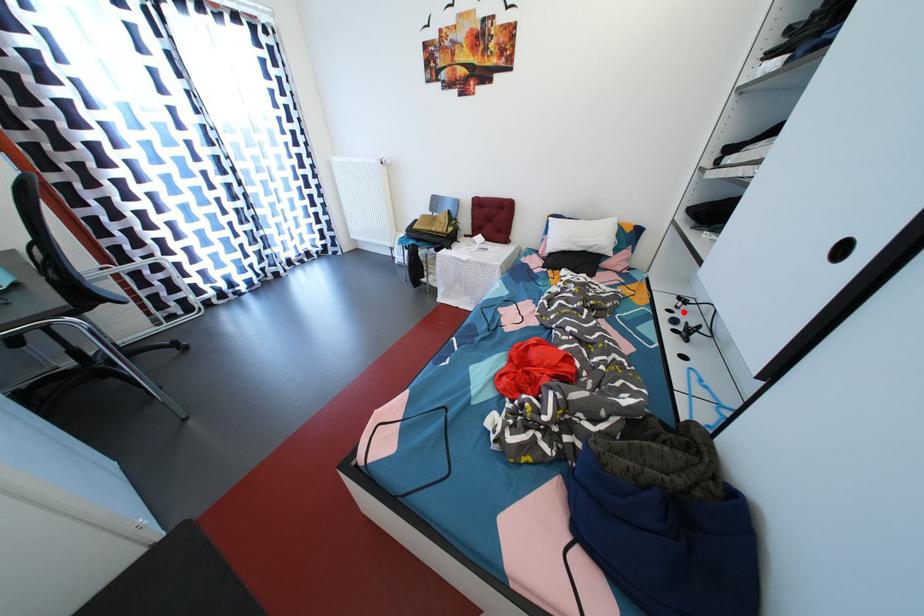
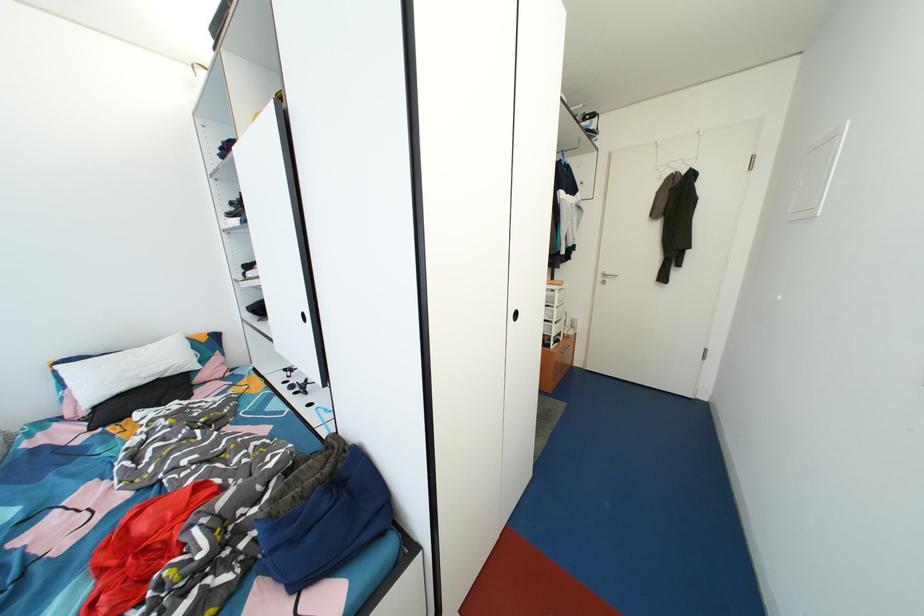
Where in the second image is the point corresponding to the highlighted location from the first image?

(295, 382)